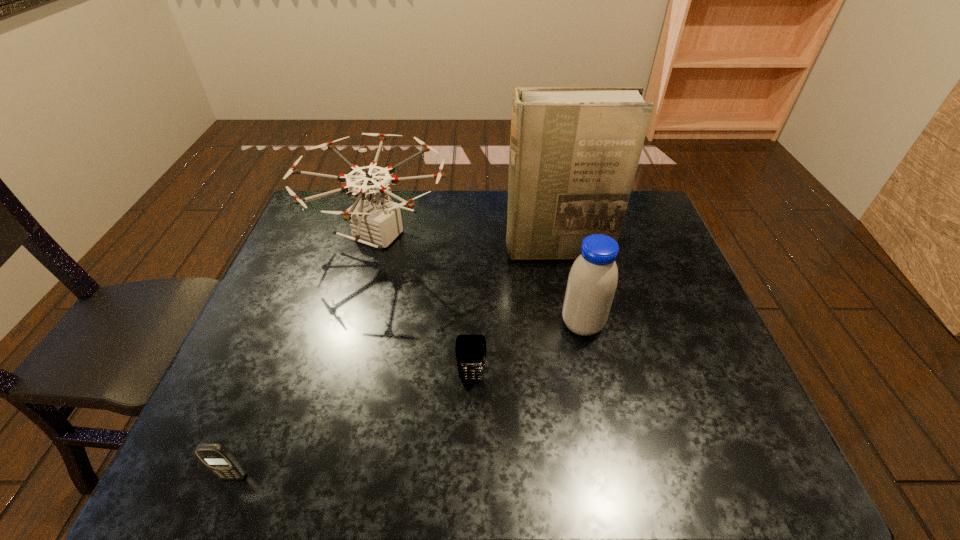
The width and height of the screenshot is (960, 540). I want to click on object that stands as the fourth closest to the shorter cellular telephone, so click(x=574, y=151).

Identify the location of free space that satisfies the following two spatial constraints: 1. on the cover of the third nearest object; 2. on the right side of the tallest object. The height and width of the screenshot is (540, 960). (571, 324).

Locate an element on the screen. free region that satisfies the following two spatial constraints: 1. on the cover of the phonebook; 2. on the right side of the soya milk is located at coordinates (571, 324).